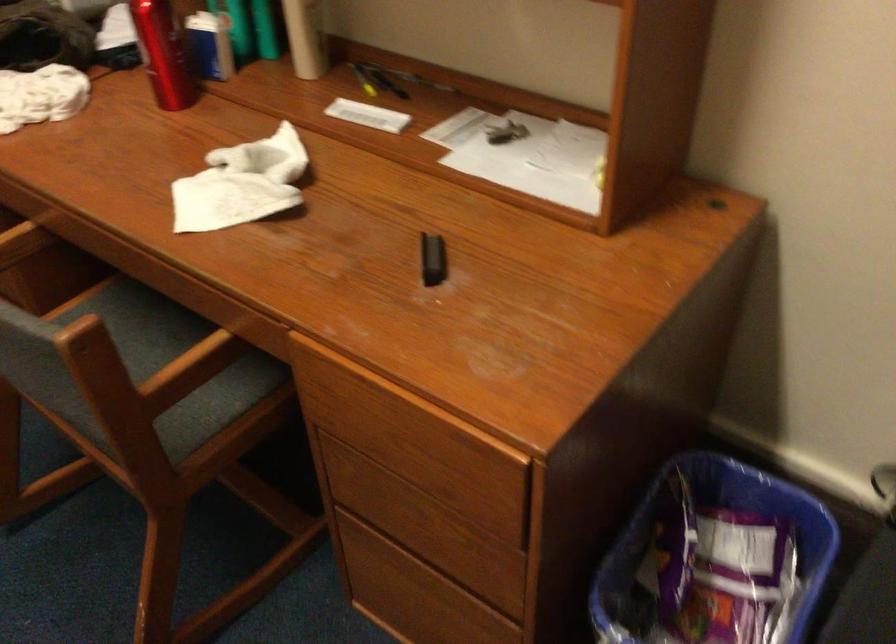
The image size is (896, 644). What do you see at coordinates (376, 80) in the screenshot? I see `the black pen` at bounding box center [376, 80].